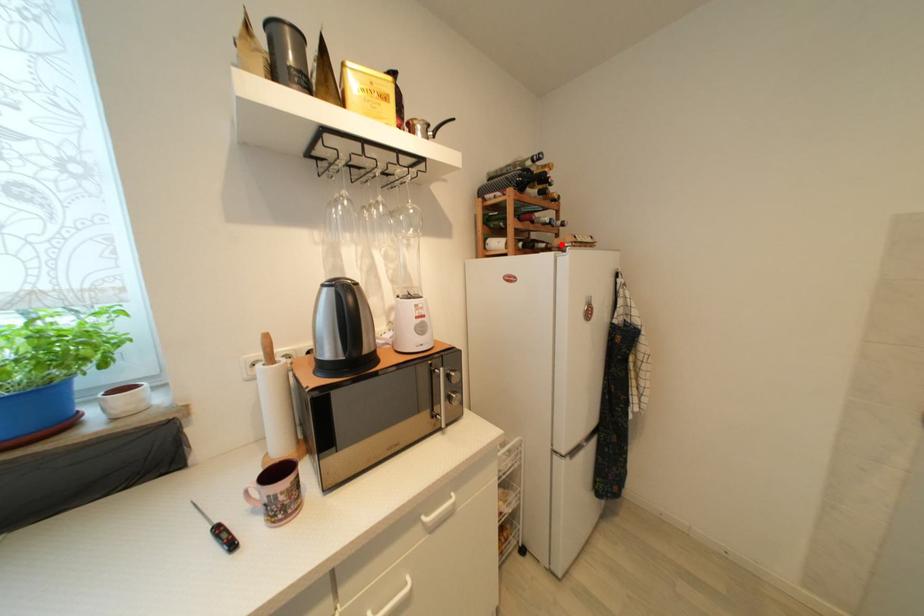
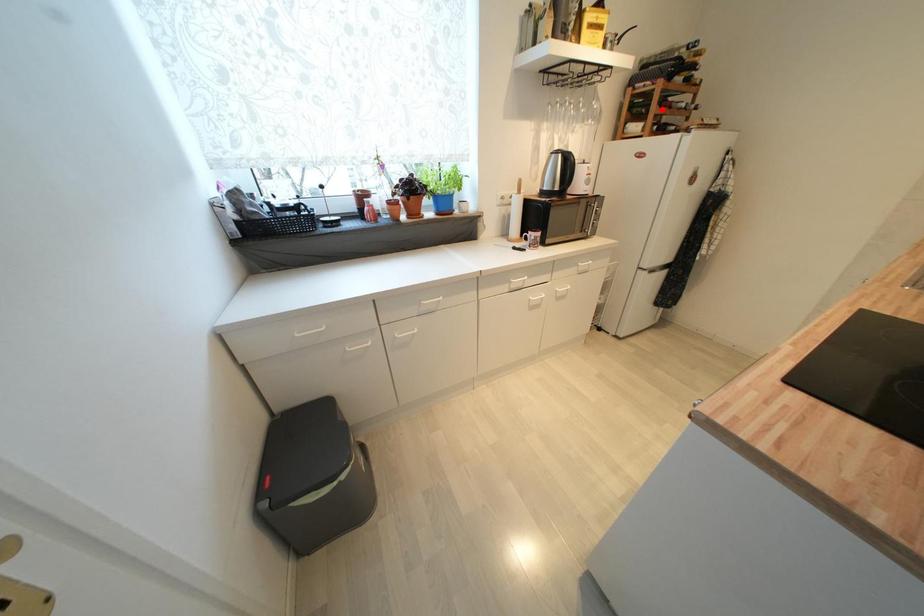
I am providing you with two images of the same scene from different viewpoints. A red point is marked on the first image and another point is marked on the second image. Is the red point in image1 aligned with the point shown in image2?

No